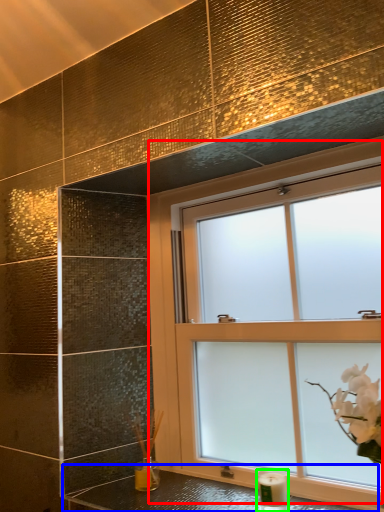
Question: Which object is the closest to the window (highlighted by a red box)? Choose among these: counter top (highlighted by a blue box) or candle holder (highlighted by a green box).

Choices:
 (A) counter top
 (B) candle holder

Answer: (A)